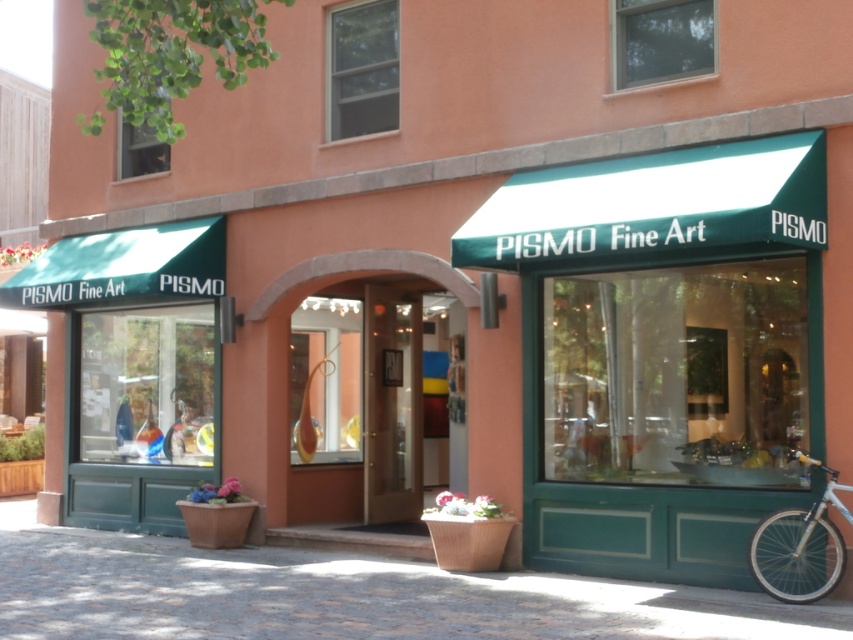
Question: Is cobblestone pavement at lower center further to the viewer compared to white metallic bicycle at lower right?

Choices:
 (A) no
 (B) yes

Answer: (A)

Question: Among these points, which one is farthest from the camera?

Choices:
 (A) pos(169,577)
 (B) pos(769,547)

Answer: (A)

Question: Is cobblestone pavement at lower center bigger than white metallic bicycle at lower right?

Choices:
 (A) no
 (B) yes

Answer: (B)

Question: Can you confirm if cobblestone pavement at lower center is positioned to the left of white metallic bicycle at lower right?

Choices:
 (A) yes
 (B) no

Answer: (A)

Question: Which of the following is the farthest from the observer?

Choices:
 (A) (496, 577)
 (B) (833, 570)

Answer: (A)